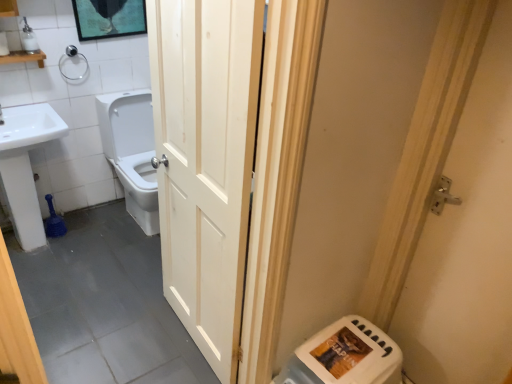
Question: Considering the relative positions of white wooden shelf at upper left and silver metallic door handle at right, acting as the second door starting from the left, in the image provided, is white wooden shelf at upper left to the right of silver metallic door handle at right, acting as the second door starting from the left, from the viewer's perspective?

Choices:
 (A) yes
 (B) no

Answer: (B)

Question: Could you tell me if white wooden shelf at upper left is turned towards silver metallic door handle at right, which is the 1th door in right-to-left order?

Choices:
 (A) no
 (B) yes

Answer: (B)

Question: From a real-world perspective, is white wooden shelf at upper left physically below silver metallic door handle at right, which is the 1th door in right-to-left order?

Choices:
 (A) yes
 (B) no

Answer: (B)

Question: Is white wooden shelf at upper left not close to silver metallic door handle at right, which is the 1th door in right-to-left order?

Choices:
 (A) no
 (B) yes

Answer: (B)

Question: Is white wooden shelf at upper left shorter than silver metallic door handle at right, which is the 1th door in right-to-left order?

Choices:
 (A) no
 (B) yes

Answer: (B)

Question: Based on their sizes in the image, would you say white plastic water heater at lower right is bigger or smaller than silver metallic door handle at right, which is the 1th door in right-to-left order?

Choices:
 (A) big
 (B) small

Answer: (B)

Question: From a real-world perspective, is white plastic water heater at lower right above or below silver metallic door handle at right, acting as the second door starting from the left?

Choices:
 (A) below
 (B) above

Answer: (A)

Question: Choose the correct answer: Is white plastic water heater at lower right inside silver metallic door handle at right, which is the 1th door in right-to-left order, or outside it?

Choices:
 (A) inside
 (B) outside

Answer: (B)

Question: From their relative heights in the image, would you say white plastic water heater at lower right is taller or shorter than silver metallic door handle at right, acting as the second door starting from the left?

Choices:
 (A) tall
 (B) short

Answer: (B)

Question: Visually, is white wooden shelf at upper left positioned to the left or to the right of satin nickel towel bar at upper left?

Choices:
 (A) right
 (B) left

Answer: (B)

Question: Considering the positions of white wooden shelf at upper left and satin nickel towel bar at upper left in the image, is white wooden shelf at upper left wider or thinner than satin nickel towel bar at upper left?

Choices:
 (A) wide
 (B) thin

Answer: (A)

Question: Is white wooden shelf at upper left taller or shorter than satin nickel towel bar at upper left?

Choices:
 (A) tall
 (B) short

Answer: (B)

Question: Is white wooden shelf at upper left spatially inside satin nickel towel bar at upper left, or outside of it?

Choices:
 (A) inside
 (B) outside

Answer: (B)

Question: From a real-world perspective, is white glossy toilet at center physically located above or below white plastic soap dispenser at upper left?

Choices:
 (A) below
 (B) above

Answer: (A)

Question: Considering their positions, is white glossy toilet at center located in front of or behind white plastic soap dispenser at upper left?

Choices:
 (A) front
 (B) behind

Answer: (B)